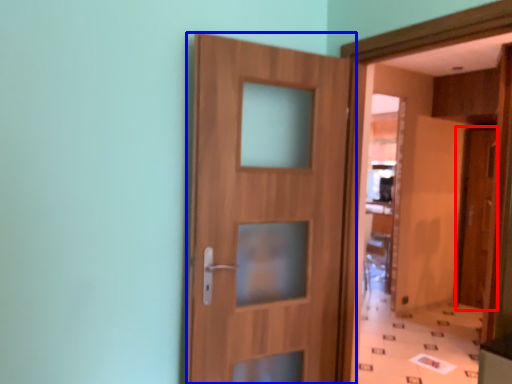
Question: Which point is closer to the camera, door (highlighted by a red box) or door (highlighted by a blue box)?

Choices:
 (A) door
 (B) door

Answer: (B)